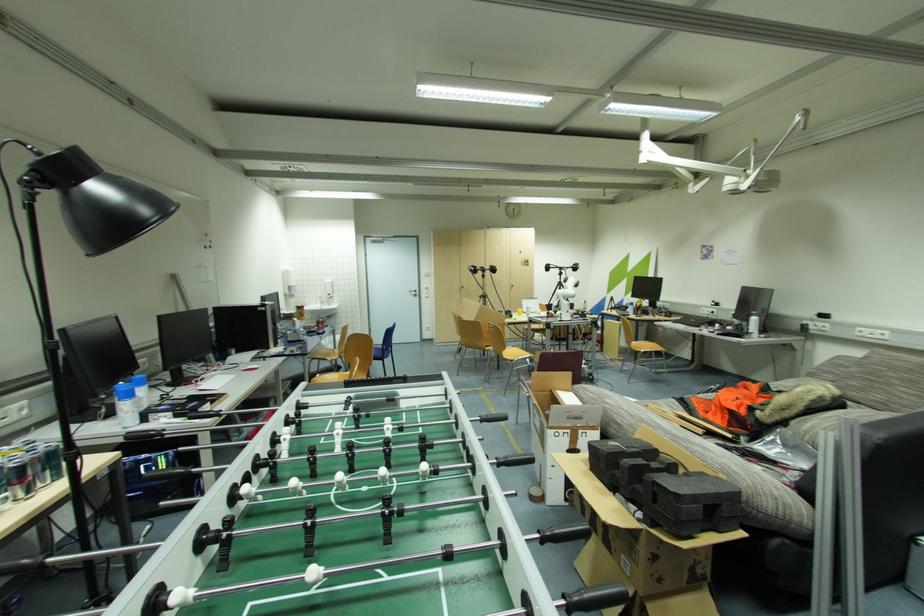
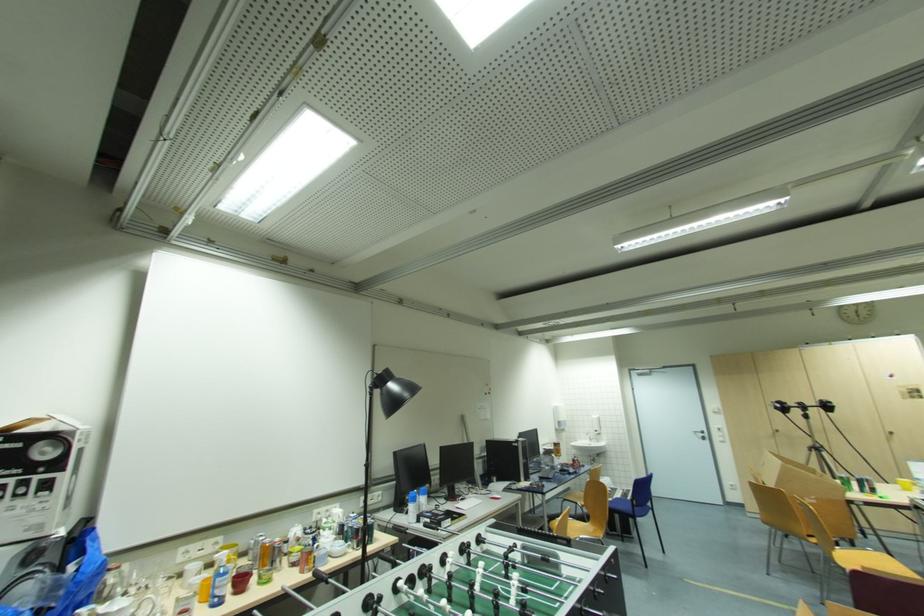
The point at (150, 213) is marked in the first image. Where is the corresponding point in the second image?

(409, 395)